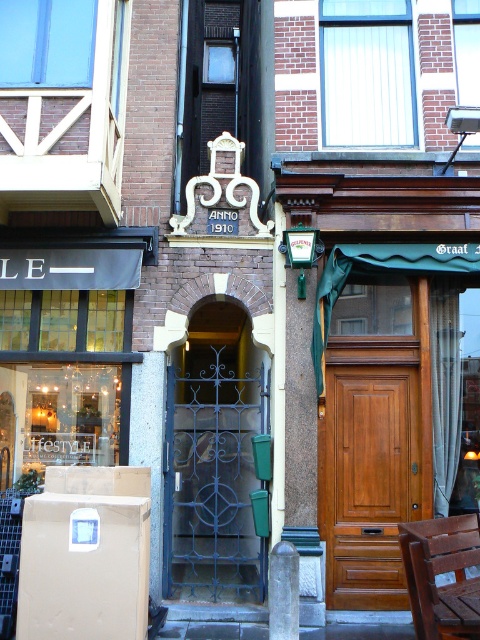
Can you confirm if brown wooden chair at lower right is taller than brown wooden table at lower right?

Yes, brown wooden chair at lower right is taller than brown wooden table at lower right.

Does brown wooden chair at lower right appear on the right side of brown wooden table at lower right?

No, brown wooden chair at lower right is not to the right of brown wooden table at lower right.

Measure the distance between brown wooden chair at lower right and camera.

brown wooden chair at lower right and camera are 15.21 feet apart.

The image size is (480, 640). I want to click on brown wooden chair at lower right, so click(x=443, y=573).

Does wrought iron gate at center have a greater width compared to brown wooden chair at lower right?

Yes, wrought iron gate at center is wider than brown wooden chair at lower right.

Does wrought iron gate at center have a smaller size compared to brown wooden chair at lower right?

Incorrect, wrought iron gate at center is not smaller in size than brown wooden chair at lower right.

Locate an element on the screen. wrought iron gate at center is located at coordinates (214, 460).

Identify the location of wrought iron gate at center. (214, 460).

Between wrought iron gate at center and wooden door at center, which one is positioned lower?

wrought iron gate at center is below.

Between point (252, 387) and point (346, 579), which one is positioned behind?

Point (252, 387)

What are the coordinates of `wrought iron gate at center` in the screenshot? It's located at (214, 460).